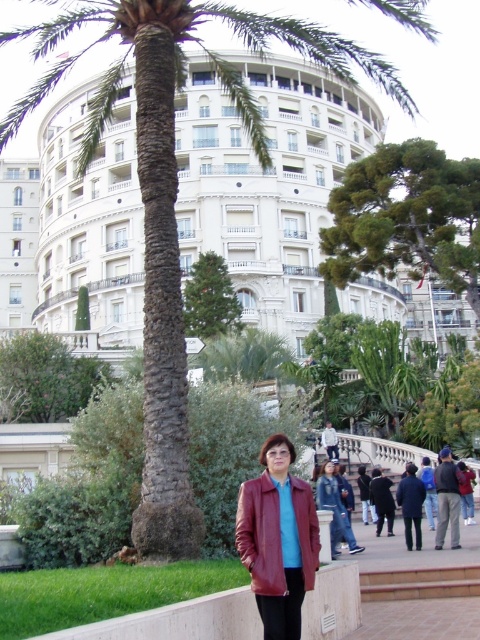
Which of these two, leather jacket at center or white glossy building at upper left, stands shorter?

leather jacket at center is shorter.

Is leather jacket at center shorter than white glossy building at upper left?

Yes, leather jacket at center is shorter than white glossy building at upper left.

Does point (261, 492) come behind point (8, 330)?

No, it is not.

Find the location of a particular element. Image resolution: width=480 pixels, height=640 pixels. leather jacket at center is located at coordinates (261, 536).

Is white glossy building at upper left positioned at the back of green textured tree at center?

No, white glossy building at upper left is closer to the viewer.

This screenshot has height=640, width=480. Identify the location of white glossy building at upper left. (17, 243).

Is leather jacket at center shorter than green textured tree at center?

Yes, leather jacket at center is shorter than green textured tree at center.

Does leather jacket at center appear on the left side of green textured tree at center?

Incorrect, leather jacket at center is not on the left side of green textured tree at center.

Locate an element on the screen. The image size is (480, 640). leather jacket at center is located at coordinates (261, 536).